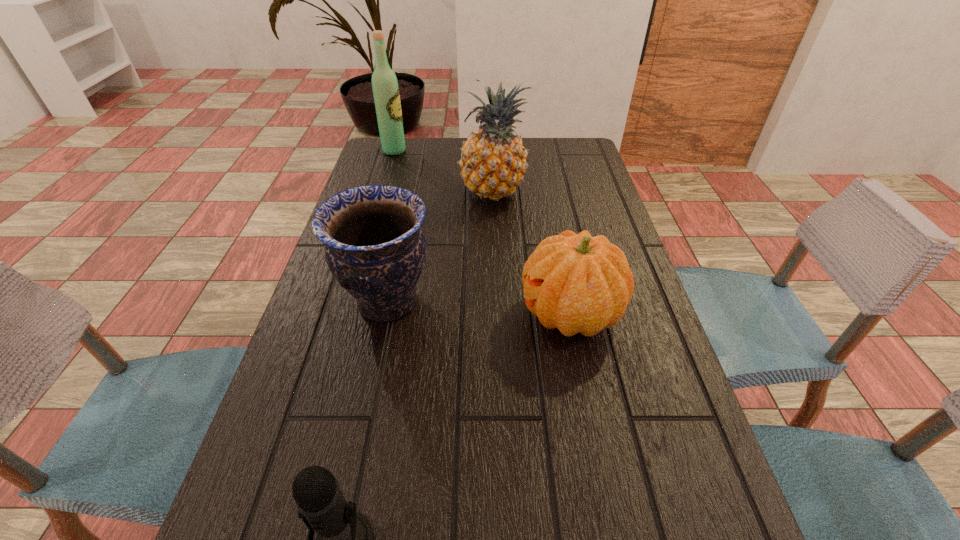
This screenshot has height=540, width=960. Identify the location of vacant area that lies between the pineapple and the farthest object. (444, 172).

You are a GUI agent. You are given a task and a screenshot of the screen. Output one action in this format:
    pyautogui.click(x=<x>, y=<y>)
    Task: Click on the unoccupied area between the pumpkin and the fourth nearest object
    
    Given the screenshot: What is the action you would take?
    pyautogui.click(x=532, y=253)

The height and width of the screenshot is (540, 960). What are the coordinates of `vacant space in between the fourth nearest object and the wine bottle` in the screenshot? It's located at (444, 172).

Locate an element on the screen. This screenshot has width=960, height=540. the fourth closest object to the pumpkin is located at coordinates (385, 87).

Locate which object ranks second in proximity to the microphone. Please provide its 2D coordinates. Your answer should be formatted as a tuple, i.e. [(x, y)], where the tuple contains the x and y coordinates of a point satisfying the conditions above.

[(574, 282)]

Locate an element on the screen. The image size is (960, 540). vacant point that satisfies the following two spatial constraints: 1. on the front-facing side of the farthest object; 2. on the right side of the fourth shortest object is located at coordinates (382, 192).

Locate an element on the screen. The height and width of the screenshot is (540, 960). free space that satisfies the following two spatial constraints: 1. on the front-facing side of the wine bottle; 2. on the right side of the pineapple is located at coordinates (382, 192).